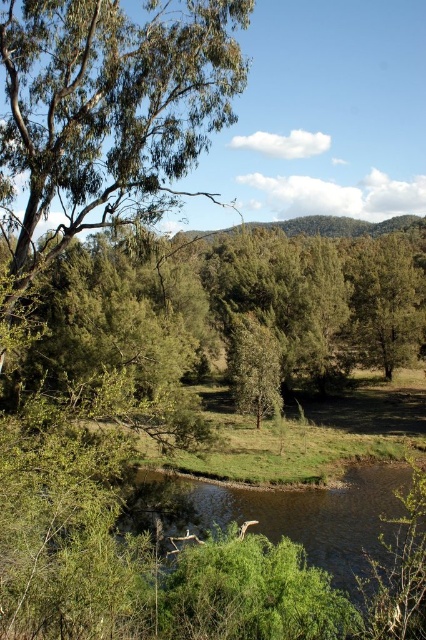
Is green leafy tree at upper left to the right of brown/rocky river at center from the viewer's perspective?

In fact, green leafy tree at upper left is to the left of brown/rocky river at center.

Is green leafy tree at upper left smaller than brown/rocky river at center?

Yes.

Is point (158, 205) positioned after point (132, 531)?

No, (158, 205) is in front of (132, 531).

Locate an element on the screen. Image resolution: width=426 pixels, height=640 pixels. green leafy tree at upper left is located at coordinates (109, 109).

What are the coordinates of `green leafy tree at upper left` in the screenshot? It's located at point(109,109).

Does green leafy tree at upper left appear on the right side of green matte tree at center?

In fact, green leafy tree at upper left is to the left of green matte tree at center.

Does point (150, 16) come closer to viewer compared to point (259, 392)?

Yes, point (150, 16) is in front of point (259, 392).

Where is `green leafy tree at upper left`? The width and height of the screenshot is (426, 640). green leafy tree at upper left is located at coordinates (109, 109).

Is point (308, 554) closer to viewer compared to point (258, 346)?

Yes, it is.

Who is positioned more to the left, brown/rocky river at center or green matte tree at center?

Positioned to the left is green matte tree at center.

Where is `brown/rocky river at center`? This screenshot has height=640, width=426. brown/rocky river at center is located at coordinates (282, 513).

Where is `brown/rocky river at center`? The image size is (426, 640). brown/rocky river at center is located at coordinates (282, 513).